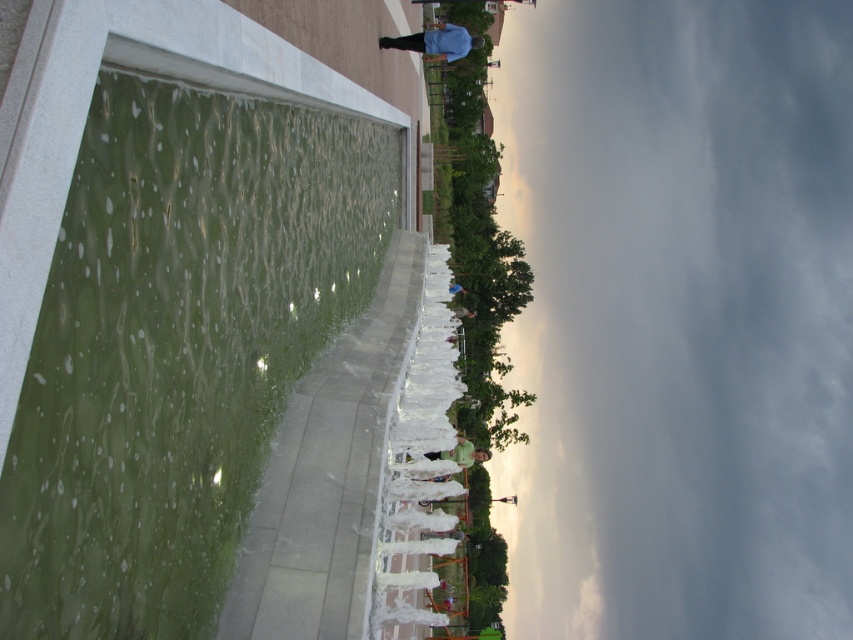
Question: Among these objects, which one is farthest from the camera?

Choices:
 (A) light blue shirt at center
 (B) green polished stone water at left
 (C) green matte shirt at center

Answer: (A)

Question: From the image, what is the correct spatial relationship of green polished stone water at left in relation to blue fabric shirt at upper center?

Choices:
 (A) right
 (B) left

Answer: (B)

Question: Which of the following is the farthest from the observer?

Choices:
 (A) pyautogui.click(x=454, y=291)
 (B) pyautogui.click(x=457, y=451)
 (C) pyautogui.click(x=136, y=259)

Answer: (B)

Question: Which point appears closest to the camera in this image?

Choices:
 (A) (305, 337)
 (B) (462, 438)
 (C) (457, 284)

Answer: (A)

Question: From the image, what is the correct spatial relationship of green polished stone water at left in relation to light blue shirt at center?

Choices:
 (A) right
 (B) left

Answer: (B)

Question: In this image, where is blue fabric shirt at upper center located relative to green matte shirt at center?

Choices:
 (A) below
 (B) above

Answer: (B)